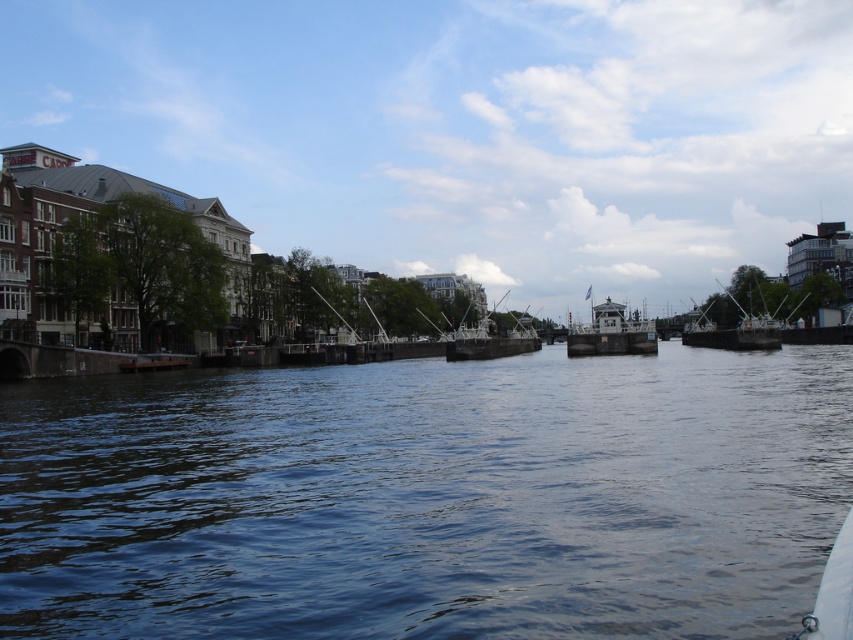
Is point (361, 596) more distant than point (759, 323)?

No, it is in front of (759, 323).

Which is in front, point (805, 449) or point (769, 342)?

Point (805, 449)

The width and height of the screenshot is (853, 640). What are the coordinates of `dark blue water at center` in the screenshot? It's located at (428, 497).

Can you confirm if dark blue water at center is positioned to the left of metallic gray cabin at center?

Yes, dark blue water at center is to the left of metallic gray cabin at center.

Consider the image. Can you confirm if dark blue water at center is smaller than metallic gray cabin at center?

Correct, dark blue water at center occupies less space than metallic gray cabin at center.

Is point (347, 492) positioned before point (595, 337)?

Yes, point (347, 492) is in front of point (595, 337).

Find the location of `dark blue water at center`. dark blue water at center is located at coordinates (428, 497).

Who is taller, metallic gray cabin at center or metallic silver boat at center?

metallic gray cabin at center is taller.

You are a GUI agent. You are given a task and a screenshot of the screen. Output one action in this format:
    pyautogui.click(x=<x>, y=<y>)
    Task: Click on the metallic gray cabin at center
    The height and width of the screenshot is (640, 853).
    Given the screenshot: What is the action you would take?
    pyautogui.click(x=611, y=332)

The width and height of the screenshot is (853, 640). Identify the location of metallic gray cabin at center. click(x=611, y=332).